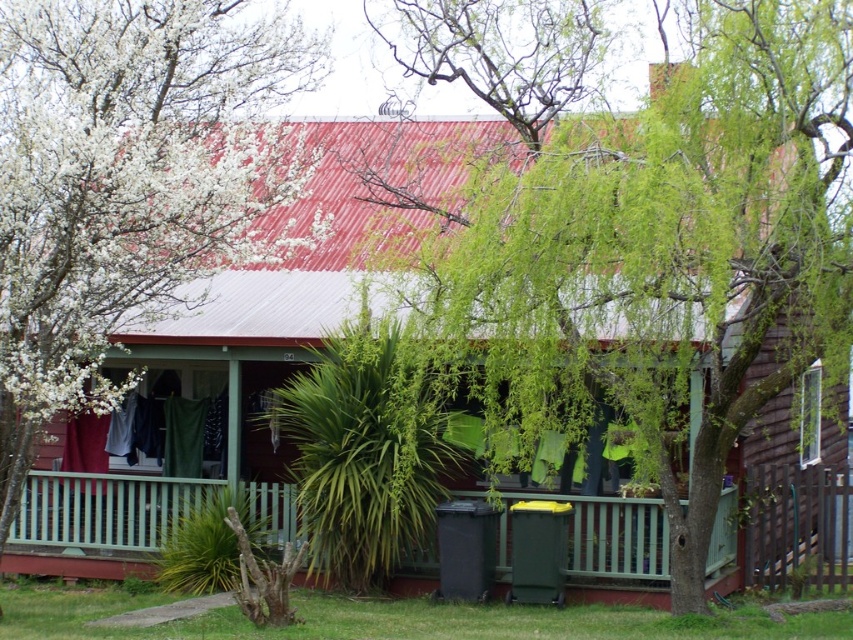
You are standing on the green wooden porch at center and want to water the plants. The spiky plant is located to your left. Which direction should you walk to reach the spiky plant first, considering the green leafy tree at center is on your right side?

Since the green leafy tree at center is on the right side of the green wooden porch at center, you should walk to your left to reach the spiky plant first as it is located to your left side.

You are standing on the lawn and looking towards the house. Which object, the green leafy tree at center or the green wooden porch at center, is higher from the ground?

The green leafy tree at center is higher from the ground than the green wooden porch at center because it is located above it.

You are a gardener planning to trim the branches of the green leafy tree at center and the white blossoming branches at upper left. Which tree requires more effort due to its size?

The green leafy tree at center requires more effort because it is larger in size than the white blossoming branches at upper left.